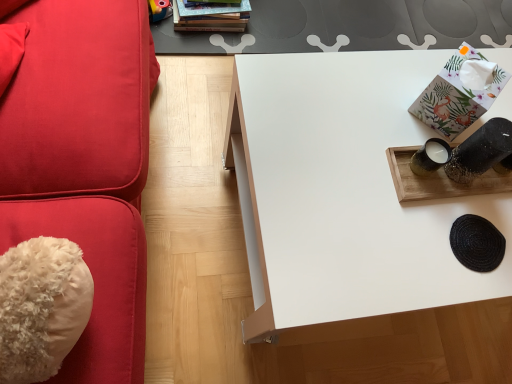
Image resolution: width=512 pixels, height=384 pixels. Find the location of `vacant area that lies to the right of hardcover books at upper center`. vacant area that lies to the right of hardcover books at upper center is located at coordinates (260, 19).